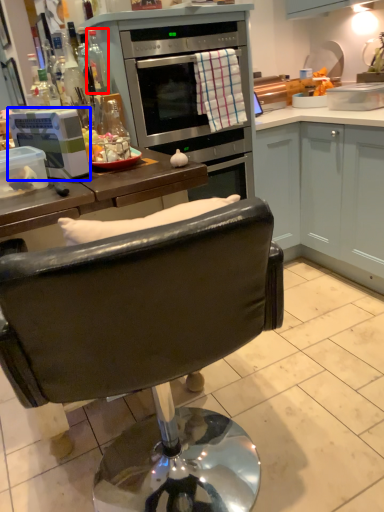
Question: Which point is closer to the camera, bottle (highlighted by a red box) or kitchen appliance (highlighted by a blue box)?

Choices:
 (A) bottle
 (B) kitchen appliance

Answer: (B)